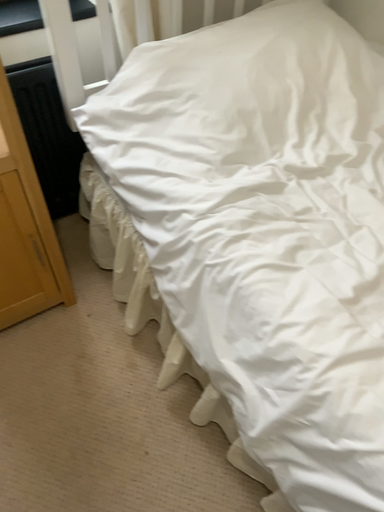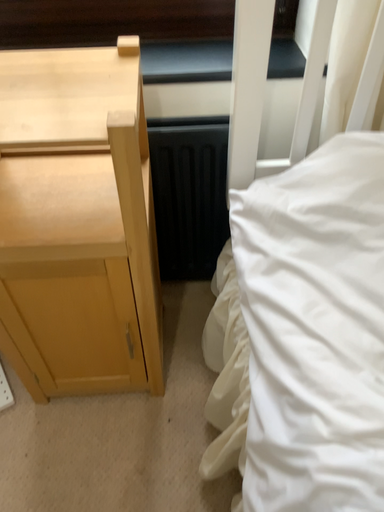
Question: How did the camera likely rotate when shooting the video?

Choices:
 (A) rotated right
 (B) rotated left

Answer: (B)